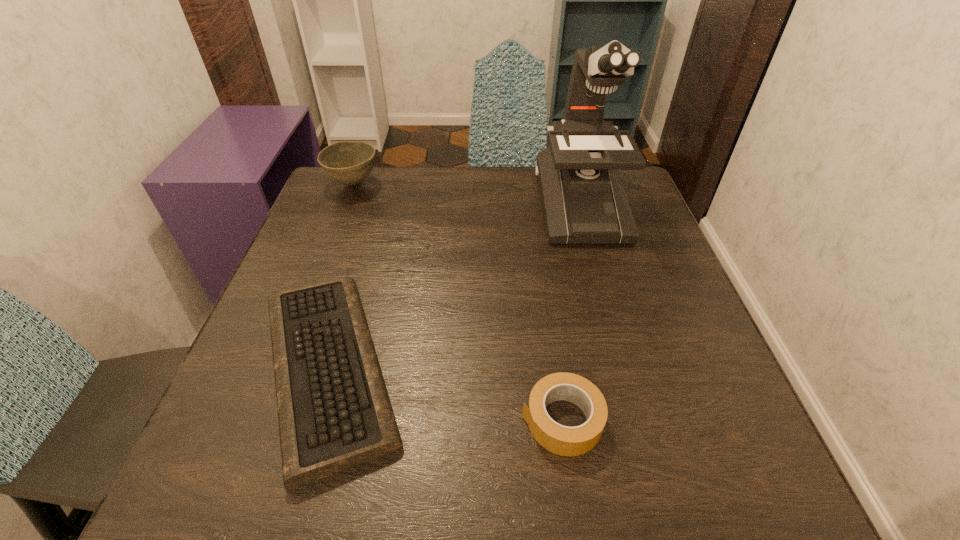
The image size is (960, 540). In the image, there is a desktop. Identify the location of vacant space at the far edge. (431, 189).

The width and height of the screenshot is (960, 540). What are the coordinates of `free space at the near edge` in the screenshot? It's located at (588, 466).

Locate an element on the screen. vacant region at the left edge of the desktop is located at coordinates (264, 375).

This screenshot has height=540, width=960. In the image, there is a desktop. Find the location of `vacant area at the right edge`. vacant area at the right edge is located at coordinates (620, 300).

You are a GUI agent. You are given a task and a screenshot of the screen. Output one action in this format:
    pyautogui.click(x=<x>, y=<y>)
    Task: Click on the vacant space at the far left corner of the desktop
    
    Given the screenshot: What is the action you would take?
    pyautogui.click(x=315, y=211)

The width and height of the screenshot is (960, 540). Find the location of `free region at the far right corner of the desktop`. free region at the far right corner of the desktop is located at coordinates (625, 171).

Find the location of a particular element. The width and height of the screenshot is (960, 540). vacant space at the near right corner of the desktop is located at coordinates (689, 457).

The image size is (960, 540). I want to click on empty space between the second shortest object and the microscope, so pyautogui.click(x=571, y=312).

Find the location of a particular element. vacant space in between the duct tape and the computer keyboard is located at coordinates (445, 394).

The image size is (960, 540). I want to click on unoccupied area between the duct tape and the shortest object, so click(x=445, y=394).